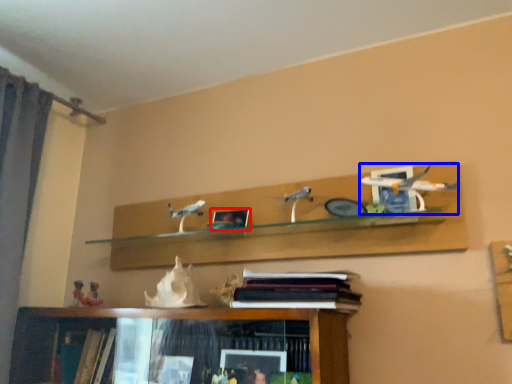
Question: Which object is further to the camera taking this photo, picture frame (highlighted by a red box) or toy (highlighted by a blue box)?

Choices:
 (A) picture frame
 (B) toy

Answer: (A)